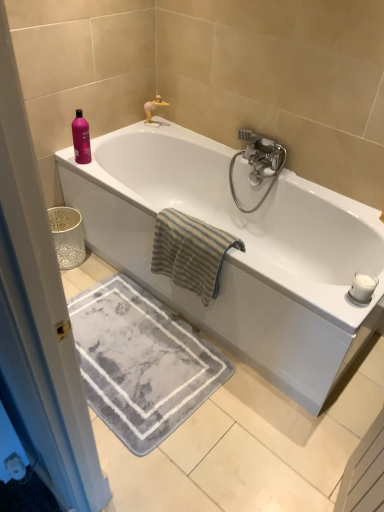
Question: Is silver metallic faucet at upper center located outside satin nickel faucet at upper right?

Choices:
 (A) no
 (B) yes

Answer: (B)

Question: Considering the relative sizes of silver metallic faucet at upper center and satin nickel faucet at upper right in the image provided, is silver metallic faucet at upper center shorter than satin nickel faucet at upper right?

Choices:
 (A) no
 (B) yes

Answer: (B)

Question: From the image's perspective, is silver metallic faucet at upper center located beneath satin nickel faucet at upper right?

Choices:
 (A) no
 (B) yes

Answer: (A)

Question: Is satin nickel faucet at upper right inside silver metallic faucet at upper center?

Choices:
 (A) no
 (B) yes

Answer: (A)

Question: Can you confirm if silver metallic faucet at upper center is smaller than satin nickel faucet at upper right?

Choices:
 (A) yes
 (B) no

Answer: (A)

Question: Does silver metallic faucet at upper center turn towards satin nickel faucet at upper right?

Choices:
 (A) yes
 (B) no

Answer: (B)

Question: Considering the relative sizes of beige striped towel at center and gray soft rug at lower center in the image provided, is beige striped towel at center shorter than gray soft rug at lower center?

Choices:
 (A) yes
 (B) no

Answer: (B)

Question: From the image's perspective, does beige striped towel at center appear lower than gray soft rug at lower center?

Choices:
 (A) no
 (B) yes

Answer: (A)

Question: Does beige striped towel at center appear on the left side of gray soft rug at lower center?

Choices:
 (A) yes
 (B) no

Answer: (B)

Question: Does beige striped towel at center touch gray soft rug at lower center?

Choices:
 (A) no
 (B) yes

Answer: (A)

Question: From the image's perspective, is beige striped towel at center above gray soft rug at lower center?

Choices:
 (A) no
 (B) yes

Answer: (B)

Question: Does beige striped towel at center come in front of gray soft rug at lower center?

Choices:
 (A) no
 (B) yes

Answer: (B)

Question: Is the position of white glossy bathtub at upper center more distant than that of satin nickel faucet at upper right?

Choices:
 (A) no
 (B) yes

Answer: (A)